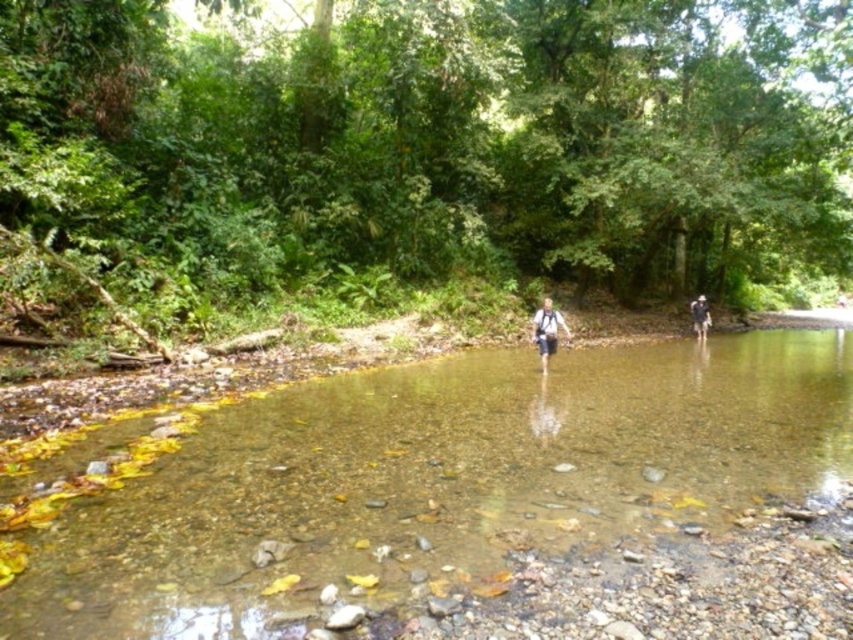
Question: Is green leafy forest at center further to the viewer compared to dark blue backpack at right?

Choices:
 (A) no
 (B) yes

Answer: (A)

Question: Can you confirm if green leafy forest at center is positioned to the left of clear water stream at center?

Choices:
 (A) yes
 (B) no

Answer: (B)

Question: Considering the real-world distances, which object is closest to the clear water stream at center?

Choices:
 (A) green leafy forest at center
 (B) dark blue backpack at right
 (C) white fabric backpack at center

Answer: (C)

Question: Among these objects, which one is farthest from the camera?

Choices:
 (A) green leafy forest at center
 (B) dark blue backpack at right
 (C) clear water stream at center

Answer: (B)

Question: From the image, what is the correct spatial relationship of green leafy forest at center in relation to clear water stream at center?

Choices:
 (A) above
 (B) below

Answer: (A)

Question: Which is nearer to the white fabric backpack at center?

Choices:
 (A) dark blue backpack at right
 (B) clear water stream at center
 (C) green leafy forest at center

Answer: (B)